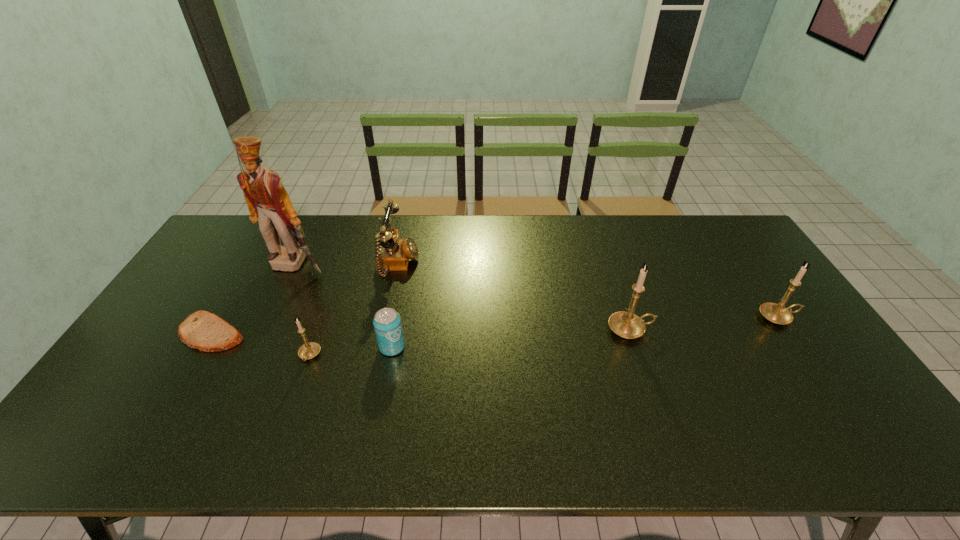
What are the coordinates of `vacant point that satisfies the following two spatial constraints: 1. on the dial number of the telephone; 2. on the back side of the beer can` in the screenshot? It's located at (380, 347).